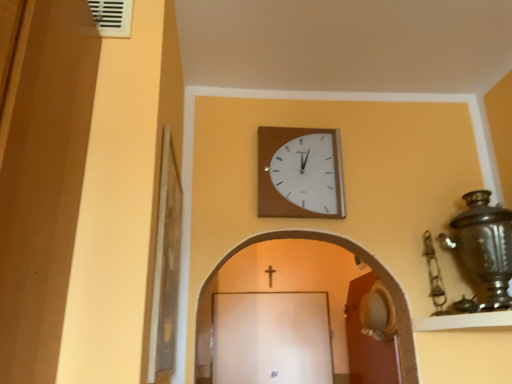
What do you see at coordinates (367, 342) in the screenshot? Image resolution: width=512 pixels, height=384 pixels. I see `brown wooden door at lower right` at bounding box center [367, 342].

Measure the distance between point (270, 277) and camera.

They are 3.26 meters apart.

This screenshot has width=512, height=384. Identify the location of brown wooden door at lower right. (367, 342).

Considering the relative sizes of brown wooden door at lower right and wooden wall clock at upper center in the image provided, is brown wooden door at lower right smaller than wooden wall clock at upper center?

Actually, brown wooden door at lower right might be larger than wooden wall clock at upper center.

From a real-world perspective, is brown wooden door at lower right physically located above or below wooden wall clock at upper center?

brown wooden door at lower right is below wooden wall clock at upper center.

Is brown wooden door at lower right wider than wooden wall clock at upper center?

Correct, the width of brown wooden door at lower right exceeds that of wooden wall clock at upper center.

Would you consider brown wooden door at lower right to be distant from wooden wall clock at upper center?

Indeed, brown wooden door at lower right is not near wooden wall clock at upper center.

Would you say wooden wall clock at upper center is inside or outside brown wooden door at lower right?

wooden wall clock at upper center is not enclosed by brown wooden door at lower right.

From the picture: Is wooden wall clock at upper center to the left of brown wooden door at lower right from the viewer's perspective?

Correct, you'll find wooden wall clock at upper center to the left of brown wooden door at lower right.

In order to click on wall clock that is above the brown wooden door at lower right (from a real-world perspective) in this screenshot , I will do 300,173.

Is point (122, 37) in front of point (369, 378)?

Yes, point (122, 37) is in front of point (369, 378).

From the picture: Which of these two, white plastic vent at upper left or brown wooden door at lower right, is smaller?

Smaller between the two is white plastic vent at upper left.

From a real-world perspective, who is located higher, white plastic vent at upper left or brown wooden door at lower right?

white plastic vent at upper left, from a real-world perspective.

Is point (370, 382) farther from viewer compared to point (103, 28)?

Yes, point (370, 382) is behind point (103, 28).

Would you say brown wooden door at lower right is a long distance from white plastic vent at upper left?

Yes, brown wooden door at lower right is far from white plastic vent at upper left.

From the picture: Is brown wooden door at lower right behind white plastic vent at upper left?

Yes, it is behind white plastic vent at upper left.

Between brown wooden door at lower right and gold metallic crucifix at center, which one appears on the left side from the viewer's perspective?

gold metallic crucifix at center is more to the left.

Looking at this image, from the image's perspective, relative to gold metallic crucifix at center, is brown wooden door at lower right above or below?

brown wooden door at lower right is below gold metallic crucifix at center.

Is brown wooden door at lower right inside the boundaries of gold metallic crucifix at center, or outside?

brown wooden door at lower right cannot be found inside gold metallic crucifix at center.

Could you tell me if brown wooden door at lower right is turned towards gold metallic crucifix at center?

Yes, brown wooden door at lower right is turned towards gold metallic crucifix at center.

In the scene shown: Between gold metallic crucifix at center and brown wooden door at lower right, which one has larger size?

brown wooden door at lower right.

Is gold metallic crucifix at center shorter than brown wooden door at lower right?

Yes.

Is gold metallic crucifix at center positioned with its back to brown wooden door at lower right?

gold metallic crucifix at center does not have its back to brown wooden door at lower right.

Between gold metallic crucifix at center and wooden wall clock at upper center, which one has smaller size?

gold metallic crucifix at center.

Based on their positions, is gold metallic crucifix at center located to the left or right of wooden wall clock at upper center?

gold metallic crucifix at center is positioned on wooden wall clock at upper center's left side.

Considering the positions of objects gold metallic crucifix at center and wooden wall clock at upper center in the image provided, who is behind, gold metallic crucifix at center or wooden wall clock at upper center?

Positioned behind is gold metallic crucifix at center.

From a real-world perspective, is gold metallic crucifix at center physically above wooden wall clock at upper center?

No, from a real-world perspective, gold metallic crucifix at center is not above wooden wall clock at upper center.

Where is `wall clock above the brown wooden door at lower right (from the image's perspective)`? Image resolution: width=512 pixels, height=384 pixels. wall clock above the brown wooden door at lower right (from the image's perspective) is located at coordinates (300, 173).

What are the coordinates of `door below the wooden wall clock at upper center (from a real-world perspective)` in the screenshot? It's located at (367, 342).

When comparing their distances from white plastic vent at upper left, does wooden wall clock at upper center or brown wooden door at lower right seem closer?

wooden wall clock at upper center is closer to white plastic vent at upper left.

Which object lies further to the anchor point white plastic vent at upper left, gold metallic crucifix at center or wooden wall clock at upper center?

gold metallic crucifix at center lies further to white plastic vent at upper left than the other object.

Estimate the real-world distances between objects in this image. Which object is closer to brown wooden door at lower right, white plastic vent at upper left or wooden wall clock at upper center?

Based on the image, wooden wall clock at upper center appears to be nearer to brown wooden door at lower right.

When comparing their distances from wooden wall clock at upper center, does brown wooden door at lower right or gold metallic crucifix at center seem closer?

The object closer to wooden wall clock at upper center is brown wooden door at lower right.

Considering their positions, is wooden wall clock at upper center positioned closer to brown wooden door at lower right than white plastic vent at upper left?

Among the two, wooden wall clock at upper center is located nearer to brown wooden door at lower right.

Consider the image. Looking at the image, which one is located further to brown wooden door at lower right, gold metallic crucifix at center or white plastic vent at upper left?

white plastic vent at upper left.

Which object lies nearer to the anchor point gold metallic crucifix at center, white plastic vent at upper left or wooden wall clock at upper center?

wooden wall clock at upper center is positioned closer to the anchor gold metallic crucifix at center.

In the scene shown: When comparing their distances from gold metallic crucifix at center, does brown wooden door at lower right or wooden wall clock at upper center seem further?

Among the two, wooden wall clock at upper center is located further to gold metallic crucifix at center.

The height and width of the screenshot is (384, 512). Identify the location of door between white plastic vent at upper left and gold metallic crucifix at center along the z-axis. (367, 342).

Identify the location of wall clock located between white plastic vent at upper left and brown wooden door at lower right in the depth direction. The width and height of the screenshot is (512, 384). [300, 173].

This screenshot has height=384, width=512. I want to click on door between wooden wall clock at upper center and gold metallic crucifix at center in the front-back direction, so click(367, 342).

The width and height of the screenshot is (512, 384). I want to click on wall clock positioned between white plastic vent at upper left and gold metallic crucifix at center from near to far, so click(300, 173).